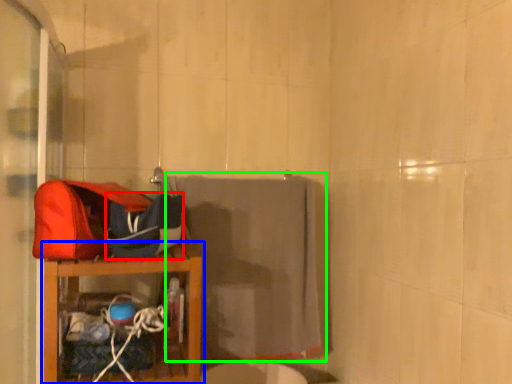
Question: Based on their relative distances, which object is farther from kit (highlighted by a red box)? Choose from furniture (highlighted by a blue box) and bath towel (highlighted by a green box).

Choices:
 (A) furniture
 (B) bath towel

Answer: (B)